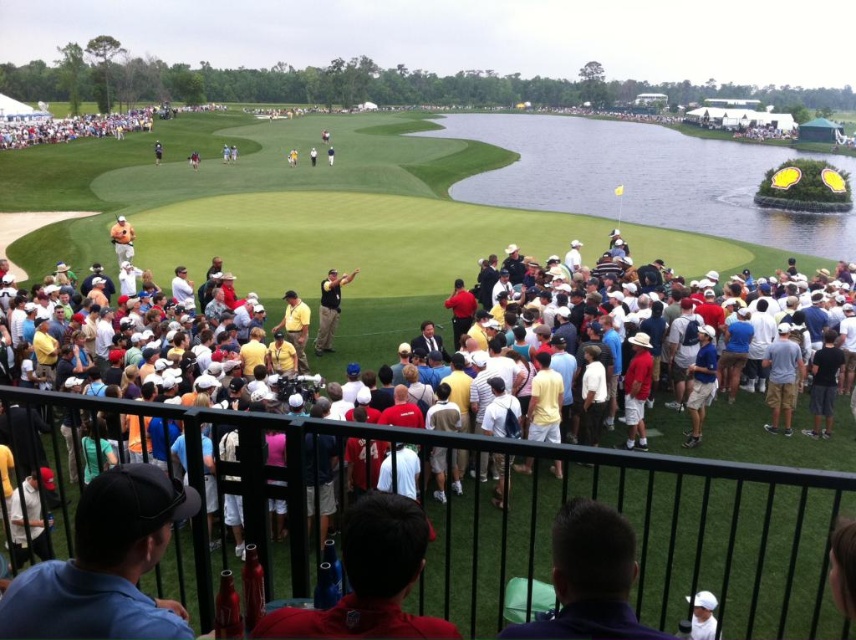
Who is positioned more to the left, gray cotton shorts at lower right or black cotton shirt at lower right?

From the viewer's perspective, gray cotton shorts at lower right appears more on the left side.

Is gray cotton shorts at lower right to the left of black cotton shirt at lower right from the viewer's perspective?

Correct, you'll find gray cotton shorts at lower right to the left of black cotton shirt at lower right.

Does point (773, 422) come closer to viewer compared to point (816, 362)?

Yes, point (773, 422) is in front of point (816, 362).

At what (x,y) coordinates should I click in order to perform the action: click on gray cotton shorts at lower right. Please return your answer as a coordinate pair (x, y). This screenshot has width=856, height=640. Looking at the image, I should click on (782, 378).

Is point (535, 138) positioned in front of point (767, 388)?

No, it is not.

Is green water at center shorter than gray cotton shorts at lower right?

Incorrect, green water at center's height does not fall short of gray cotton shorts at lower right's.

The image size is (856, 640). In order to click on green water at center in this screenshot , I will do `click(640, 179)`.

Does gray cotton shorts at lower right have a lesser height compared to yellow cotton shirt at center?

Incorrect, gray cotton shorts at lower right's height does not fall short of yellow cotton shirt at center's.

Between point (783, 384) and point (536, 355), which one is positioned in front?

Positioned in front is point (536, 355).

Which is in front, point (777, 332) or point (535, 356)?

Point (535, 356) is more forward.

Where is `gray cotton shorts at lower right`? The height and width of the screenshot is (640, 856). gray cotton shorts at lower right is located at coordinates [782, 378].